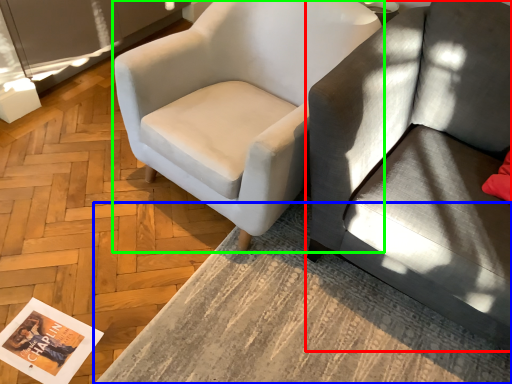
Question: Based on their relative distances, which object is nearer to studio couch (highlighted by a red box)? Choose from table (highlighted by a blue box) and chair (highlighted by a green box).

Choices:
 (A) table
 (B) chair

Answer: (B)